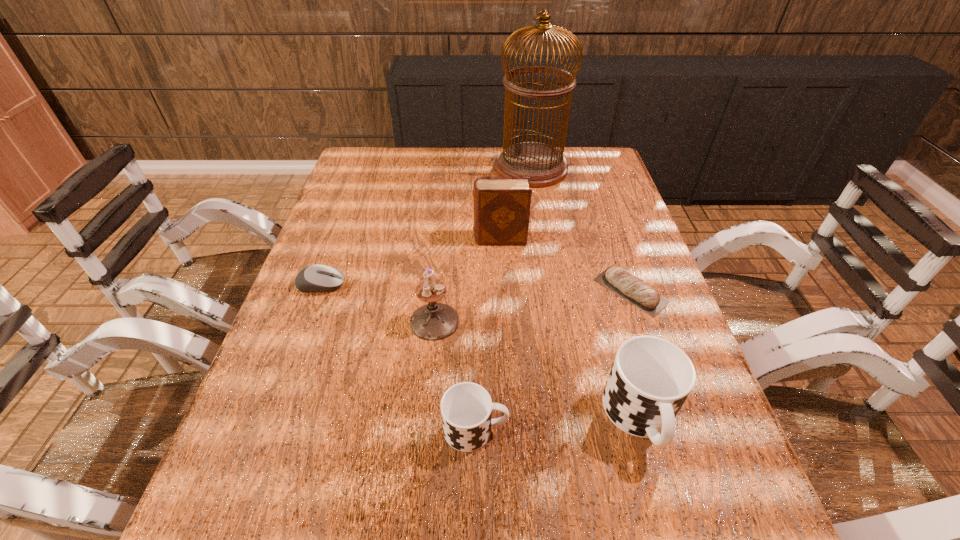
Where is `vacant area situated on the side of the shorter cup with the handle`? This screenshot has height=540, width=960. vacant area situated on the side of the shorter cup with the handle is located at coordinates (556, 429).

The height and width of the screenshot is (540, 960). What are the coordinates of `blank space located on the front-facing side of the tallest object` in the screenshot? It's located at (377, 168).

Identify the location of vacant space located on the front-facing side of the tallest object. Image resolution: width=960 pixels, height=540 pixels. (471, 168).

Locate an element on the screen. This screenshot has height=540, width=960. free spot located 0.350m on the front-facing side of the tallest object is located at coordinates (393, 168).

At what (x,y) coordinates should I click in order to perform the action: click on free space located 0.260m on the front of the candle holder. Please return your answer as a coordinate pair (x, y). The width and height of the screenshot is (960, 540). Looking at the image, I should click on (421, 457).

Identify the location of vacant region located on the spine side of the diary. The width and height of the screenshot is (960, 540). (340, 239).

The width and height of the screenshot is (960, 540). In order to click on free location located 0.240m on the spine side of the diary in this screenshot , I will do `click(387, 239)`.

This screenshot has height=540, width=960. Identify the location of free space located on the spine side of the diary. (340, 239).

Locate an element on the screen. Image resolution: width=960 pixels, height=540 pixels. blank space located on the wheel side of the leftmost object is located at coordinates (381, 285).

At what (x,y) coordinates should I click in order to perform the action: click on blank area located on the back of the pita bread. Please return your answer as a coordinate pair (x, y). The image size is (960, 540). Looking at the image, I should click on (602, 207).